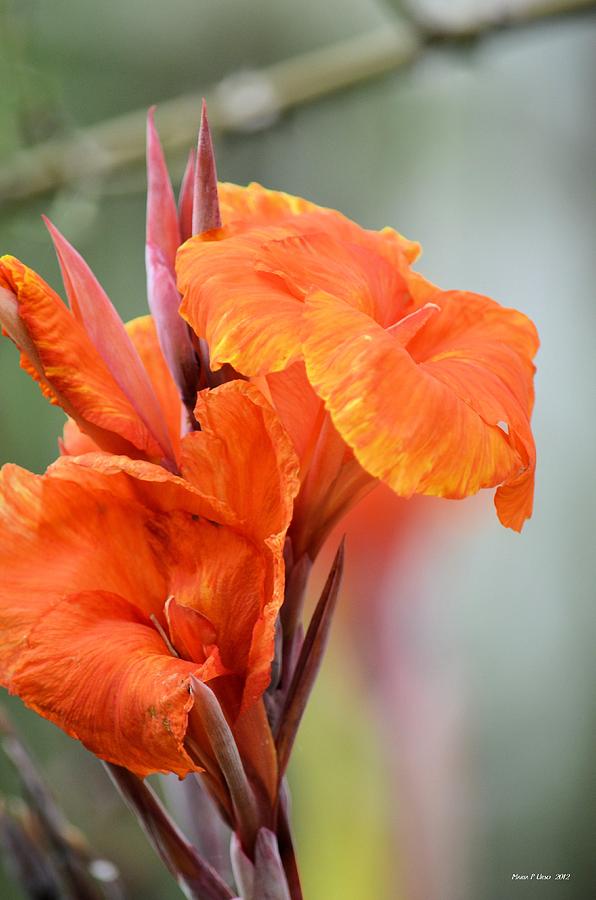
Find the location of a particular element. bulb is located at coordinates (151, 199), (207, 211), (182, 194), (102, 320).